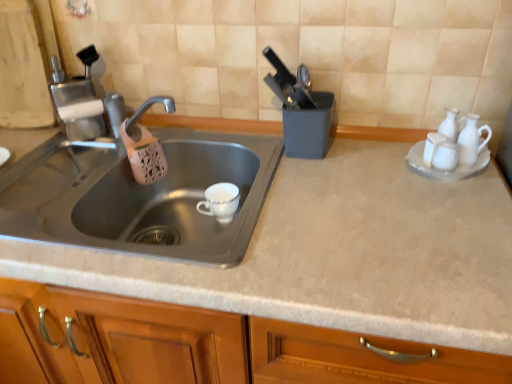
The width and height of the screenshot is (512, 384). I want to click on free space in front of white ceramic pitcher at right, the first tableware positioned from the right, so click(x=472, y=210).